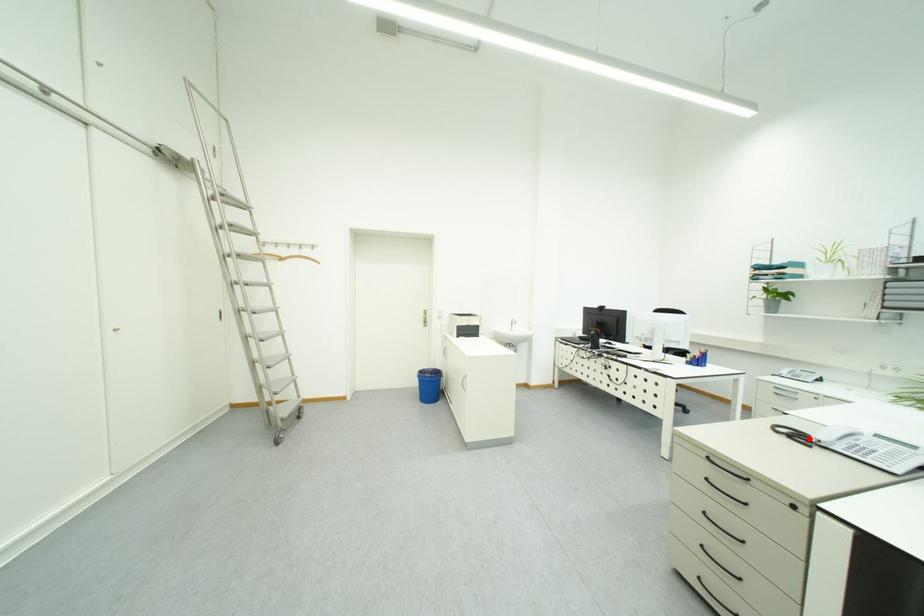
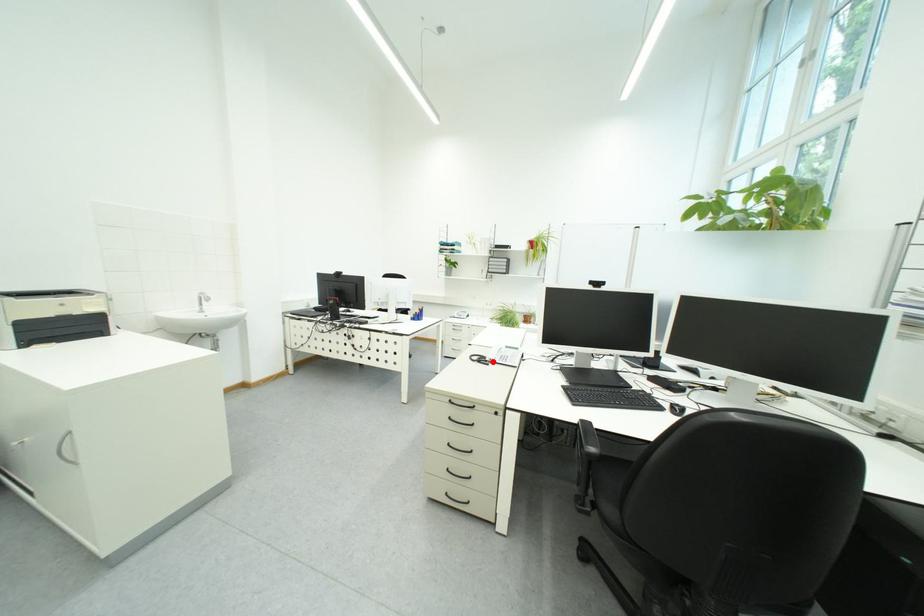
I am providing you with two images of the same scene from different viewpoints. A red point is marked on the first image and another point is marked on the second image. Do the highlighted points in image1 and image2 indicate the same real-world spot?

Yes